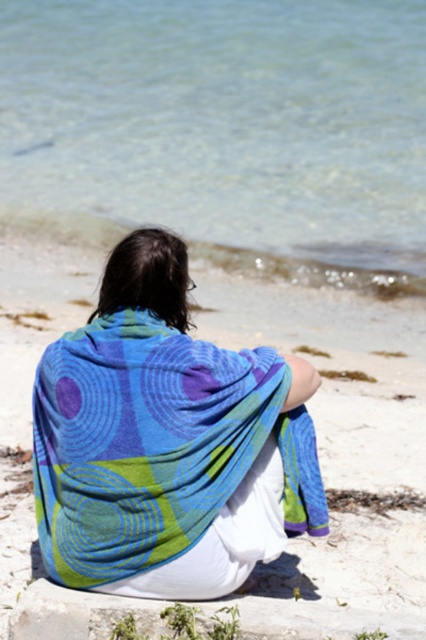
You are a photographer trying to capture the ocean in this beach scene. The image has a point marked at coordinates (224, 131). Where should you focus your camera to ensure the clearest view of the ocean?

The point at (224, 131) marks clear water at upper center, so you should focus your camera on the clear water at upper center to capture the clearest view of the ocean.